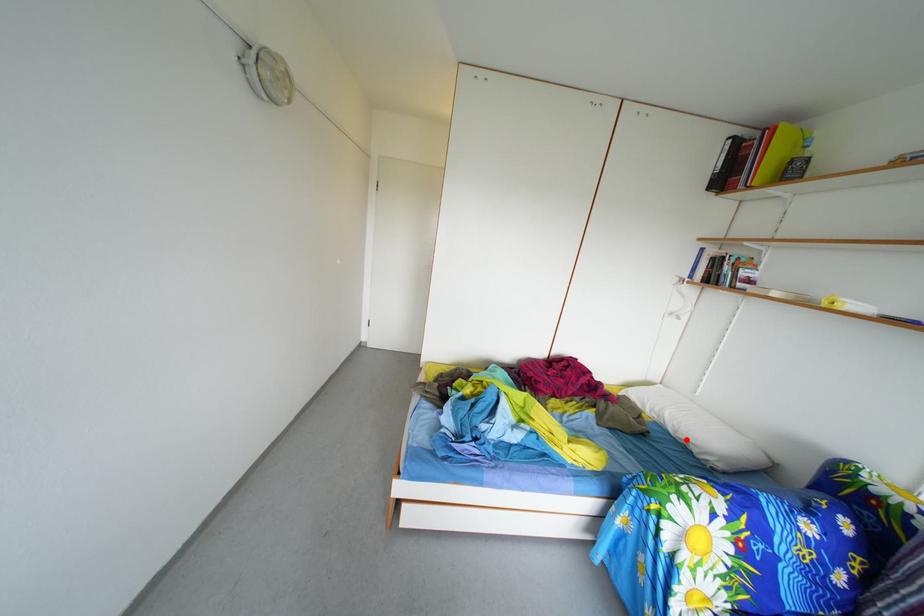
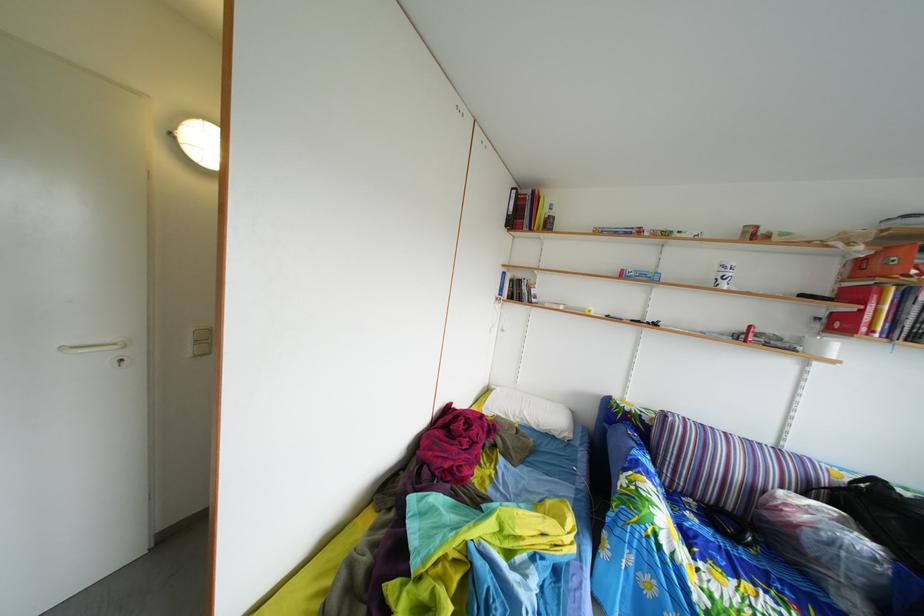
Where in the second image is the point corresponding to the highlighted location from the first image?

(549, 434)